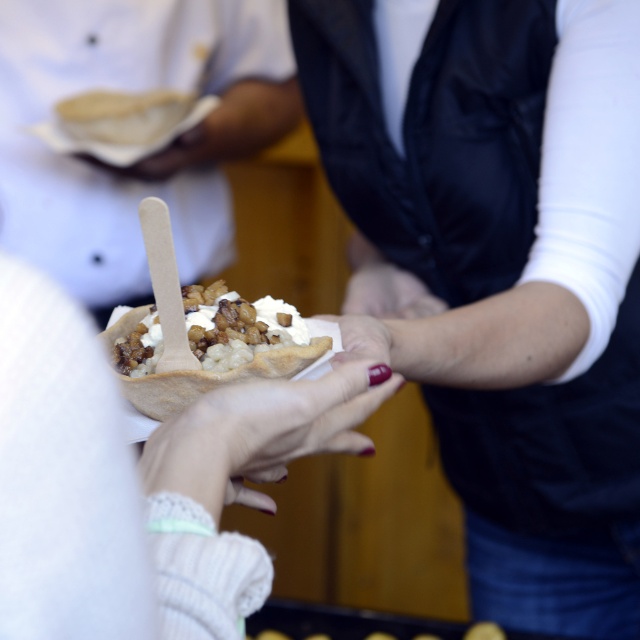
You are a food critic attending a dessert tasting event. You see the matte white bowl at center on the table. If you want to reach it without moving your chair, can you do it? Assume your arm can extend 1.5 meters.

The matte white bowl at center is 1.59 meters away from the viewer. Since your arm can only extend 1.5 meters, you cannot reach the matte white bowl at center without moving your chair.

You are a customer at a dessert stall and see the white fabric hand at center holding the white creamy dessert at center. Can you tell me which object is wider?

The white creamy dessert at center is wider than the white fabric hand at center.

You are at a dessert stall and see the matte black vest at center worn by the server and the nail polish at center on their hand. Which object is wider?

The matte black vest at center is wider than the nail polish at center.